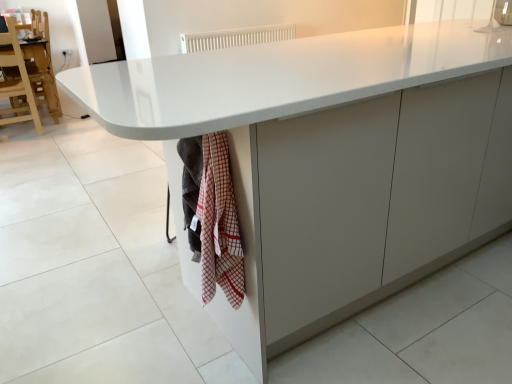
Describe the element at coordinates (236, 38) in the screenshot. I see `white plastic radiator at upper center` at that location.

What do you see at coordinates (214, 214) in the screenshot? Image resolution: width=512 pixels, height=384 pixels. I see `red checkered towel at lower center` at bounding box center [214, 214].

The width and height of the screenshot is (512, 384). Find the location of `white glossy granite at lower left`. white glossy granite at lower left is located at coordinates (69, 311).

Is point (212, 170) closer or farther from the camera than point (30, 102)?

Point (212, 170) is positioned closer to the camera compared to point (30, 102).

Is red checkered towel at lower center in contact with wooden chair at left?

No, red checkered towel at lower center is not making contact with wooden chair at left.

Could you tell me if red checkered towel at lower center is turned towards wooden chair at left?

No.

Does red checkered towel at lower center appear on the left side of wooden chair at left?

No, red checkered towel at lower center is not to the left of wooden chair at left.

Does white glossy granite at lower left touch white plastic radiator at upper center?

white glossy granite at lower left and white plastic radiator at upper center are not in contact.

Does white glossy granite at lower left come behind white plastic radiator at upper center?

No, it is not.

From a real-world perspective, is white glossy granite at lower left positioned above or below white plastic radiator at upper center?

From a real-world perspective, white glossy granite at lower left is physically below white plastic radiator at upper center.

What's the angular difference between white glossy granite at lower left and white plastic radiator at upper center's facing directions?

They differ by 90.5 degrees in their facing directions.

Is white plastic radiator at upper center positioned far away from red checkered towel at lower center?

Yes, white plastic radiator at upper center and red checkered towel at lower center are located far from each other.

Does white plastic radiator at upper center have a lesser width compared to red checkered towel at lower center?

Incorrect, the width of white plastic radiator at upper center is not less than that of red checkered towel at lower center.

Between white plastic radiator at upper center and red checkered towel at lower center, which one has smaller size?

With smaller size is red checkered towel at lower center.

Would you say red checkered towel at lower center is part of wooden chair at left's contents?

No, red checkered towel at lower center is not a part of wooden chair at left.

From the picture: Is wooden chair at left positioned in front of red checkered towel at lower center?

No, wooden chair at left is behind red checkered towel at lower center.

Considering the positions of points (30, 117) and (186, 211), is point (30, 117) farther from camera compared to point (186, 211)?

Yes, it is.

From a real-world perspective, between wooden chair at left and red checkered towel at lower center, who is vertically lower?

wooden chair at left.

How different are the orientations of white plastic radiator at upper center and wooden chair at left in degrees?

The angle between the facing direction of white plastic radiator at upper center and the facing direction of wooden chair at left is 176 degrees.

Between white plastic radiator at upper center and wooden chair at left, which one has less height?

white plastic radiator at upper center is shorter.

Which of these two, white plastic radiator at upper center or wooden chair at left, is smaller?

white plastic radiator at upper center.

Between point (254, 43) and point (32, 88), which one is positioned in front?

The point (32, 88) is more forward.

Would you say wooden chair at left is inside or outside white glossy granite at lower left?

wooden chair at left is not inside white glossy granite at lower left, it's outside.

I want to click on granite lying on the right of wooden chair at left, so click(69, 311).

Would you say wooden chair at left is a long distance from white glossy granite at lower left?

Yes, wooden chair at left and white glossy granite at lower left are located far from each other.

Is white plastic radiator at upper center at the back of red checkered towel at lower center?

No.

How many degrees apart are the facing directions of red checkered towel at lower center and white plastic radiator at upper center?

89.7 degrees.

Can you confirm if red checkered towel at lower center is positioned to the right of white plastic radiator at upper center?

No, red checkered towel at lower center is not to the right of white plastic radiator at upper center.

From the image's perspective, who appears lower, red checkered towel at lower center or white plastic radiator at upper center?

From the image's view, red checkered towel at lower center is below.

Locate an element on the screen. The height and width of the screenshot is (384, 512). blanket below the wooden chair at left (from the image's perspective) is located at coordinates point(214,214).

You are a GUI agent. You are given a task and a screenshot of the screen. Output one action in this format:
    pyautogui.click(x=<x>, y=<y>)
    Task: Click on the radiator lying above the white glossy granite at lower left (from the image's perspective)
    Image resolution: width=512 pixels, height=384 pixels.
    Given the screenshot: What is the action you would take?
    pyautogui.click(x=236, y=38)

Looking at the image, which one is located further to red checkered towel at lower center, white glossy granite at lower left or wooden chair at left?

wooden chair at left is further to red checkered towel at lower center.

Estimate the real-world distances between objects in this image. Which object is further from white plastic radiator at upper center, white glossy granite at lower left or wooden chair at left?

white glossy granite at lower left.

When comparing their distances from white glossy granite at lower left, does white plastic radiator at upper center or red checkered towel at lower center seem closer?

The object closer to white glossy granite at lower left is red checkered towel at lower center.

When comparing their distances from red checkered towel at lower center, does wooden chair at left or white plastic radiator at upper center seem further?

wooden chair at left is further to red checkered towel at lower center.

Based on their spatial positions, is wooden chair at left or red checkered towel at lower center closer to white plastic radiator at upper center?

Based on the image, wooden chair at left appears to be nearer to white plastic radiator at upper center.

Which object lies further to the anchor point white plastic radiator at upper center, white glossy granite at lower left or red checkered towel at lower center?

red checkered towel at lower center is positioned further to the anchor white plastic radiator at upper center.

Based on their spatial positions, is red checkered towel at lower center or wooden chair at left further from white glossy granite at lower left?

wooden chair at left is positioned further to the anchor white glossy granite at lower left.

Estimate the real-world distances between objects in this image. Which object is closer to white glossy granite at lower left, white plastic radiator at upper center or wooden chair at left?

wooden chair at left.

What are the coordinates of `granite between red checkered towel at lower center and white plastic radiator at upper center along the z-axis` in the screenshot? It's located at (69, 311).

At what (x,y) coordinates should I click in order to perform the action: click on chair between red checkered towel at lower center and white plastic radiator at upper center in the front-back direction. Please return your answer as a coordinate pair (x, y). This screenshot has height=384, width=512. Looking at the image, I should click on (17, 82).

Identify the location of chair located between white glossy granite at lower left and white plastic radiator at upper center in the depth direction. The image size is (512, 384). (17, 82).

Locate an element on the screen. The image size is (512, 384). granite between red checkered towel at lower center and wooden chair at left along the z-axis is located at coordinates (69, 311).